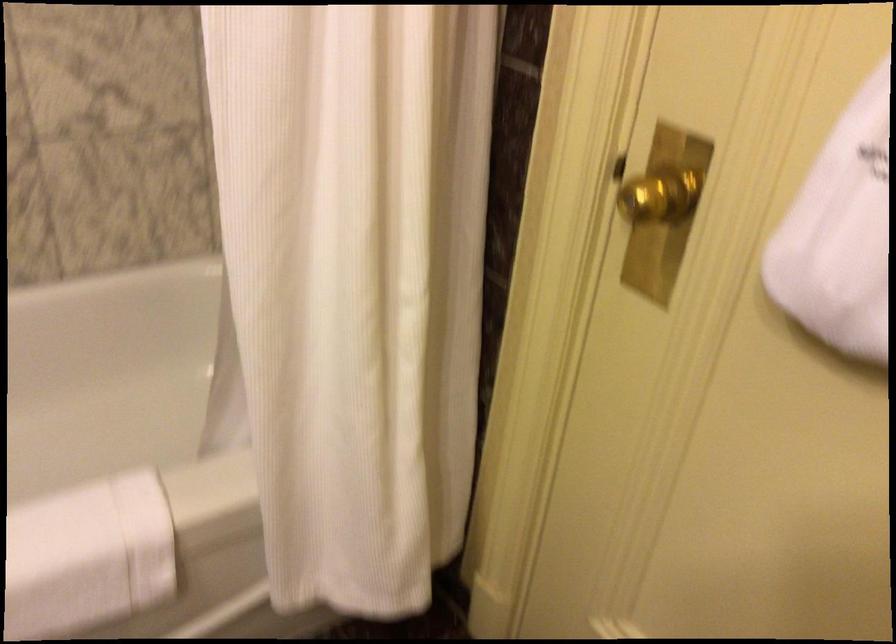
Image resolution: width=896 pixels, height=644 pixels. What are the coordinates of `gold door knob` in the screenshot? It's located at (657, 194).